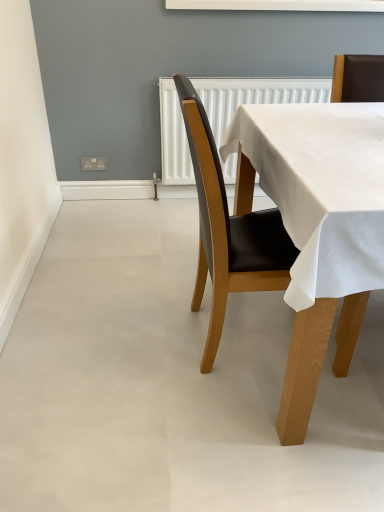
Image resolution: width=384 pixels, height=512 pixels. I want to click on free spot in front of brown leather chair at center, so click(213, 439).